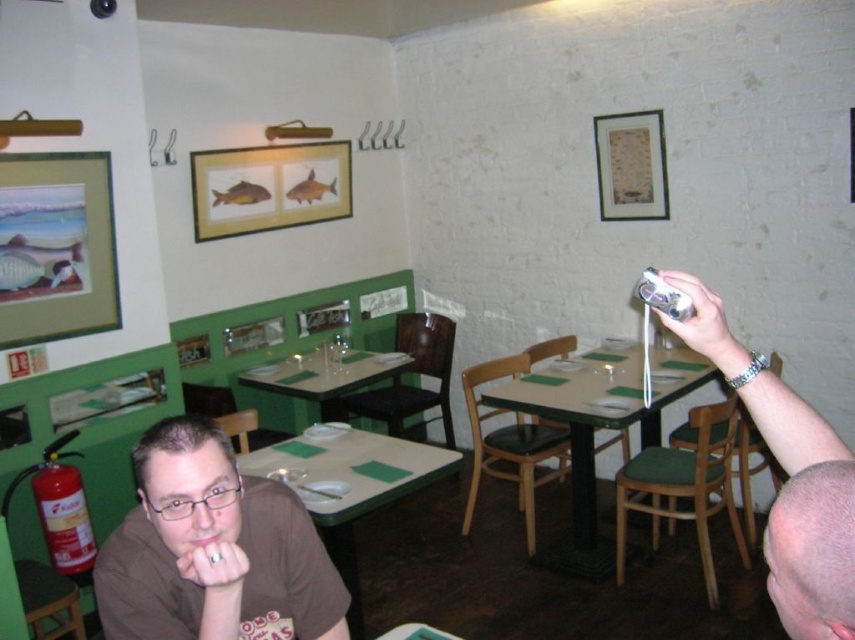
Does green wooden table at center have a lesser width compared to green wood table at center?

Incorrect, green wooden table at center's width is not less than green wood table at center's.

Which is in front, point (644, 408) or point (370, 358)?

Point (644, 408)

This screenshot has width=855, height=640. In order to click on green wooden table at center in this screenshot , I will do `click(597, 428)`.

Who is positioned more to the left, brown matte shirt at lower left or silver metallic camera at upper right?

brown matte shirt at lower left is more to the left.

Does brown matte shirt at lower left have a greater height compared to silver metallic camera at upper right?

Indeed, brown matte shirt at lower left has a greater height compared to silver metallic camera at upper right.

Does point (264, 616) lie in front of point (724, 376)?

No.

I want to click on brown matte shirt at lower left, so click(x=213, y=548).

What do you see at coordinates (352, 486) in the screenshot? This screenshot has width=855, height=640. I see `green matte table at center` at bounding box center [352, 486].

Is green matte table at center closer to camera compared to green wood table at center?

Yes, it is in front of green wood table at center.

Which is behind, point (296, 449) or point (331, 378)?

Positioned behind is point (331, 378).

The image size is (855, 640). I want to click on green matte table at center, so click(352, 486).